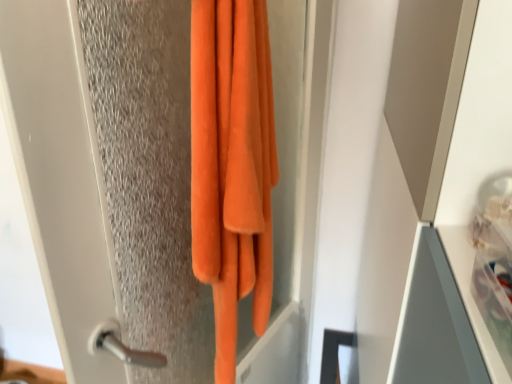
This screenshot has width=512, height=384. I want to click on orange fuzzy towel at center, so click(232, 164).

Measure the distance between point [253,119] and camera.

A distance of 25.24 inches exists between point [253,119] and camera.

What do you see at coordinates (232, 164) in the screenshot? I see `orange fuzzy towel at center` at bounding box center [232, 164].

In order to face orange fuzzy towel at center, should I rotate leftwards or rightwards?

To face it directly, rotate left by 2.050 degrees.

What are the coordinates of `orange fuzzy towel at center` in the screenshot? It's located at (232, 164).